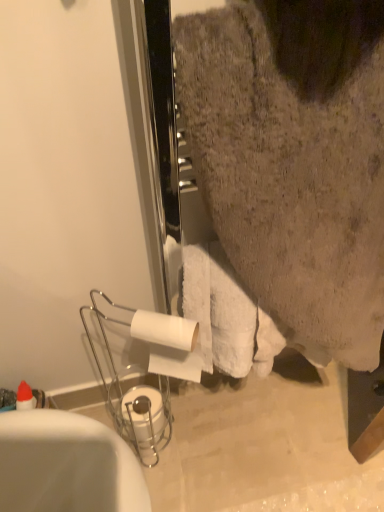
Identify the location of white matte toilet paper at lower center, marked as the first toilet paper in a back-to-front arrangement. This screenshot has height=512, width=384. (144, 412).

This screenshot has height=512, width=384. Describe the element at coordinates (294, 158) in the screenshot. I see `white fluffy towel at upper right` at that location.

This screenshot has height=512, width=384. What are the coordinates of `white glossy bathtub at lower left` in the screenshot? It's located at (66, 465).

Is white matte toilet paper at lower center, marked as the first toilet paper in a back-to-front arrangement, thinner than white matte toilet paper at center, which is counted as the second toilet paper, starting from the bottom?

In fact, white matte toilet paper at lower center, marked as the first toilet paper in a back-to-front arrangement, might be wider than white matte toilet paper at center, which is counted as the second toilet paper, starting from the bottom.

From the picture: Is white matte toilet paper at lower center, marked as the first toilet paper in a back-to-front arrangement, not inside white matte toilet paper at center, which ranks as the 1th toilet paper in top-to-bottom order?

Yes, white matte toilet paper at lower center, marked as the first toilet paper in a back-to-front arrangement, is located beyond the bounds of white matte toilet paper at center, which ranks as the 1th toilet paper in top-to-bottom order.

Does point (154, 410) appear closer or farther from the camera than point (150, 353)?

Point (154, 410) appears to be farther away from the viewer than point (150, 353).

In the scene shown: Is white fluffy towel at upper right facing away from white matte toilet paper at lower center, which ranks as the second toilet paper in top-to-bottom order?

No, white fluffy towel at upper right's orientation is not away from white matte toilet paper at lower center, which ranks as the second toilet paper in top-to-bottom order.

Considering the relative positions of white fluffy towel at upper right and white matte toilet paper at lower center, marked as the first toilet paper in a back-to-front arrangement, in the image provided, is white fluffy towel at upper right to the left or to the right of white matte toilet paper at lower center, marked as the first toilet paper in a back-to-front arrangement,?

white fluffy towel at upper right is positioned on white matte toilet paper at lower center, marked as the first toilet paper in a back-to-front arrangement,'s right side.

Considering the positions of points (258, 59) and (151, 388), is point (258, 59) farther from camera compared to point (151, 388)?

No, it is not.

Would you consider white fluffy towel at upper right to be distant from white matte toilet paper at lower center, which appears as the second toilet paper when viewed from the front?

No, there isn't a large distance between white fluffy towel at upper right and white matte toilet paper at lower center, which appears as the second toilet paper when viewed from the front.

Who is bigger, white glossy bathtub at lower left or white matte toilet paper at center, the first toilet paper when ordered from front to back?

white glossy bathtub at lower left.

From the picture: Is white glossy bathtub at lower left outside of white matte toilet paper at center, which is counted as the second toilet paper, starting from the bottom?

white glossy bathtub at lower left lies outside white matte toilet paper at center, which is counted as the second toilet paper, starting from the bottom,'s area.

Is point (113, 449) closer to camera compared to point (170, 362)?

Yes, it is in front of point (170, 362).

Considering the relative positions of white matte toilet paper at center, which ranks as the 1th toilet paper in top-to-bottom order, and white matte toilet paper at lower center, marked as the first toilet paper in a back-to-front arrangement, in the image provided, is white matte toilet paper at center, which ranks as the 1th toilet paper in top-to-bottom order, behind white matte toilet paper at lower center, marked as the first toilet paper in a back-to-front arrangement,?

No, white matte toilet paper at center, which ranks as the 1th toilet paper in top-to-bottom order, is closer to the viewer.

Locate an element on the screen. toilet paper on the left side of white matte toilet paper at center, which is counted as the second toilet paper, starting from the bottom is located at coordinates (144, 412).

Can you confirm if white matte toilet paper at center, which ranks as the 1th toilet paper in top-to-bottom order, is positioned to the left of white matte toilet paper at lower center, marked as the first toilet paper in a back-to-front arrangement?

No.

Can you tell me how much white matte toilet paper at center, which is counted as the 2th toilet paper, starting from the back, and white fluffy towel at upper right differ in facing direction?

The angle between the facing direction of white matte toilet paper at center, which is counted as the 2th toilet paper, starting from the back, and the facing direction of white fluffy towel at upper right is 26.3 degrees.

Is white matte toilet paper at center, which is counted as the second toilet paper, starting from the bottom, closer to camera compared to white fluffy towel at upper right?

No.

Considering the sizes of white matte toilet paper at center, which is counted as the second toilet paper, starting from the bottom, and white fluffy towel at upper right in the image, is white matte toilet paper at center, which is counted as the second toilet paper, starting from the bottom, wider or thinner than white fluffy towel at upper right?

In the image, white matte toilet paper at center, which is counted as the second toilet paper, starting from the bottom, appears to be more narrow than white fluffy towel at upper right.

Which point is more forward, (x=196, y=359) or (x=329, y=37)?

The point (x=329, y=37) is closer to the camera.

Consider the image. Is white matte toilet paper at lower center, which appears as the second toilet paper when viewed from the front, in contact with white fluffy towel at upper right?

white matte toilet paper at lower center, which appears as the second toilet paper when viewed from the front, is not next to white fluffy towel at upper right, and they're not touching.

What's the angular difference between white matte toilet paper at lower center, which ranks as the second toilet paper in top-to-bottom order, and white fluffy towel at upper right's facing directions?

The facing directions of white matte toilet paper at lower center, which ranks as the second toilet paper in top-to-bottom order, and white fluffy towel at upper right are 3.56 degrees apart.

Is white matte toilet paper at lower center, which ranks as the second toilet paper in top-to-bottom order, at the left side of white fluffy towel at upper right?

Answer: Yes.

How distant is white matte toilet paper at lower center, which ranks as the second toilet paper in top-to-bottom order, from white fluffy towel at upper right?

27.14 inches.

Does white fluffy towel at upper right turn towards white matte toilet paper at center, which is counted as the second toilet paper, starting from the bottom?

No, white fluffy towel at upper right does not turn towards white matte toilet paper at center, which is counted as the second toilet paper, starting from the bottom.

Considering the positions of points (378, 337) and (182, 376), is point (378, 337) farther from camera compared to point (182, 376)?

No, it is in front of (182, 376).

Does white fluffy towel at upper right contain white matte toilet paper at center, which is counted as the 2th toilet paper, starting from the back?

No, white matte toilet paper at center, which is counted as the 2th toilet paper, starting from the back, is located outside of white fluffy towel at upper right.

Is white fluffy towel at upper right bigger than white matte toilet paper at center, the first toilet paper when ordered from front to back?

Yes.

Identify the location of toilet paper below the white matte toilet paper at center, which is counted as the 2th toilet paper, starting from the back (from the image's perspective). (144, 412).

Where is `toilet paper that is the 2nd object to the left of the white fluffy towel at upper right, starting at the anchor`? toilet paper that is the 2nd object to the left of the white fluffy towel at upper right, starting at the anchor is located at coordinates (144, 412).

Considering their positions, is white matte toilet paper at center, the first toilet paper when ordered from front to back, positioned further to white glossy bathtub at lower left than white matte toilet paper at lower center, marked as the first toilet paper in a back-to-front arrangement?

white matte toilet paper at lower center, marked as the first toilet paper in a back-to-front arrangement, lies further to white glossy bathtub at lower left than the other object.

Looking at the image, which one is located further to white glossy bathtub at lower left, white fluffy towel at upper right or white matte toilet paper at lower center, which appears as the second toilet paper when viewed from the front?

white fluffy towel at upper right.

Estimate the real-world distances between objects in this image. Which object is closer to white matte toilet paper at lower center, which appears as the second toilet paper when viewed from the front, white fluffy towel at upper right or white glossy bathtub at lower left?

The object closer to white matte toilet paper at lower center, which appears as the second toilet paper when viewed from the front, is white glossy bathtub at lower left.

When comparing their distances from white fluffy towel at upper right, does white glossy bathtub at lower left or white matte toilet paper at lower center, which appears as the second toilet paper when viewed from the front, seem closer?

The object closer to white fluffy towel at upper right is white glossy bathtub at lower left.

Based on their spatial positions, is white fluffy towel at upper right or white matte toilet paper at center, the first toilet paper when ordered from front to back, closer to white matte toilet paper at lower center, arranged as the 1th toilet paper when ordered from the bottom?

Based on the image, white matte toilet paper at center, the first toilet paper when ordered from front to back, appears to be nearer to white matte toilet paper at lower center, arranged as the 1th toilet paper when ordered from the bottom.

When comparing their distances from white fluffy towel at upper right, does white matte toilet paper at lower center, which ranks as the second toilet paper in top-to-bottom order, or white matte toilet paper at center, which is counted as the 2th toilet paper, starting from the back, seem further?

white matte toilet paper at lower center, which ranks as the second toilet paper in top-to-bottom order, is further to white fluffy towel at upper right.

Considering their positions, is white matte toilet paper at center, which ranks as the 1th toilet paper in top-to-bottom order, positioned further to white fluffy towel at upper right than white matte toilet paper at lower center, which appears as the second toilet paper when viewed from the front?

white matte toilet paper at lower center, which appears as the second toilet paper when viewed from the front.

Consider the image. Looking at the image, which one is located closer to white matte toilet paper at center, which ranks as the 1th toilet paper in top-to-bottom order, white matte toilet paper at lower center, marked as the first toilet paper in a back-to-front arrangement, or white glossy bathtub at lower left?

Among the two, white glossy bathtub at lower left is located nearer to white matte toilet paper at center, which ranks as the 1th toilet paper in top-to-bottom order.

Locate an element on the screen. The width and height of the screenshot is (384, 512). toilet paper between white glossy bathtub at lower left and white matte toilet paper at lower center, which appears as the second toilet paper when viewed from the front, in the front-back direction is located at coordinates 169,344.

Image resolution: width=384 pixels, height=512 pixels. What are the coordinates of `toilet paper between white fluffy towel at upper right and white matte toilet paper at lower center, arranged as the 1th toilet paper when ordered from the bottom, in the front-back direction` in the screenshot? It's located at (169, 344).

Locate an element on the screen. bathtub between white fluffy towel at upper right and white matte toilet paper at lower center, which appears as the second toilet paper when viewed from the front, in the front-back direction is located at coordinates (66, 465).